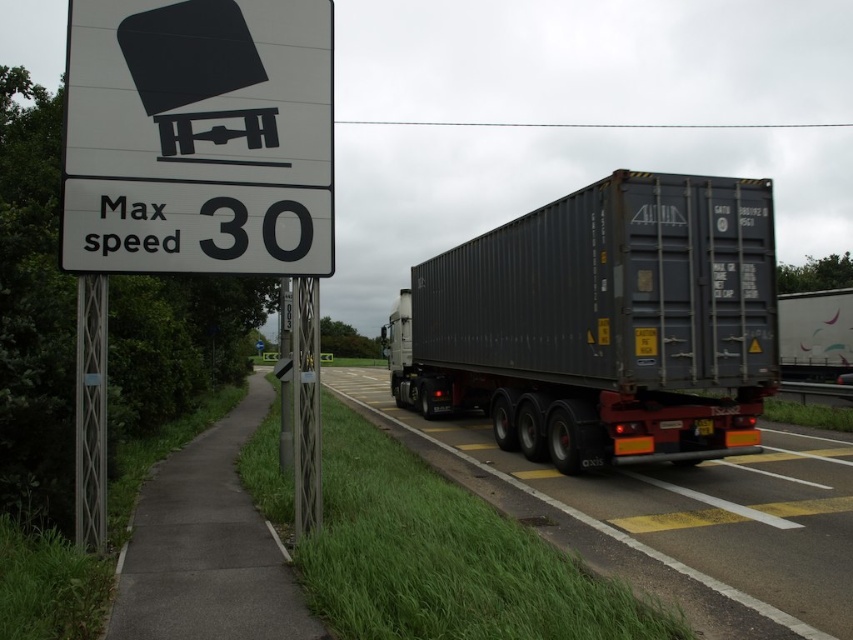
You are a delivery driver approaching the road sign on the left. You see a point at coordinates (602, 323). What object is located at that point?

The point at coordinates (602, 323) indicates the matte black trailer truck at center.

You are a driver approaching the white paper sign at upper left and the metallic gray trailer at center. Which object is positioned higher relative to the road?

The white paper sign at upper left is positioned higher relative to the road than the metallic gray trailer at center because it is above it.

You are a GPS navigation system trying to locate the matte black trailer truck at center in the image. What are its coordinates?

The matte black trailer truck at center is located at coordinates [602,323].